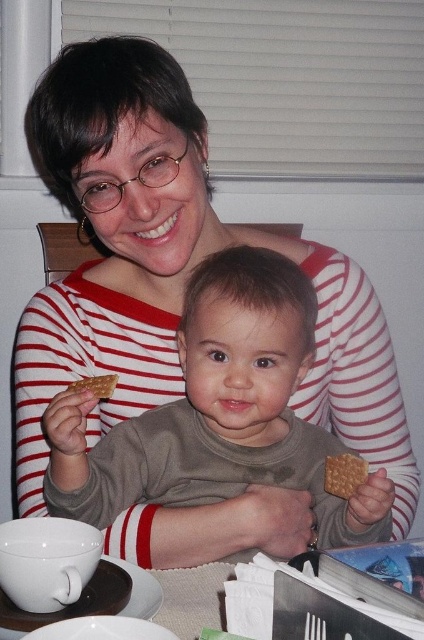
Question: Considering the real-world distances, which object is farthest from the crusty golden cracker at center?

Choices:
 (A) matte brown cracker at lower right
 (B) matte gray shirt at center

Answer: (A)

Question: Among these objects, which one is nearest to the camera?

Choices:
 (A) crusty golden cracker at center
 (B) matte brown cracker at lower right

Answer: (A)

Question: Can you confirm if matte gray shirt at center is wider than crusty golden cracker at center?

Choices:
 (A) yes
 (B) no

Answer: (A)

Question: Is matte gray shirt at center above matte brown cracker at lower right?

Choices:
 (A) yes
 (B) no

Answer: (A)

Question: Does matte gray shirt at center come behind crusty golden cracker at center?

Choices:
 (A) no
 (B) yes

Answer: (A)

Question: Which of the following is the closest to the observer?

Choices:
 (A) matte gray shirt at center
 (B) crusty golden cracker at center
 (C) matte brown cracker at lower right

Answer: (A)